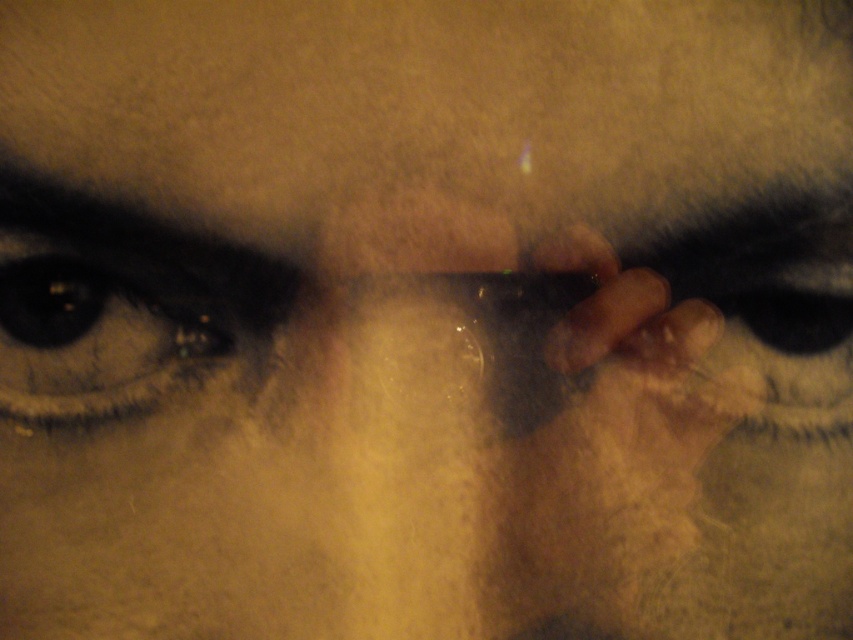
Question: Can you confirm if smooth skin at center is positioned above brown matte eye at left?

Choices:
 (A) no
 (B) yes

Answer: (B)

Question: Which object is farther from the camera taking this photo?

Choices:
 (A) brown matte eye at left
 (B) smooth skin at center

Answer: (A)

Question: Does smooth skin at center lie behind brown matte eye at left?

Choices:
 (A) yes
 (B) no

Answer: (B)

Question: Can you confirm if smooth skin at center is positioned below brown matte eye at left?

Choices:
 (A) yes
 (B) no

Answer: (B)